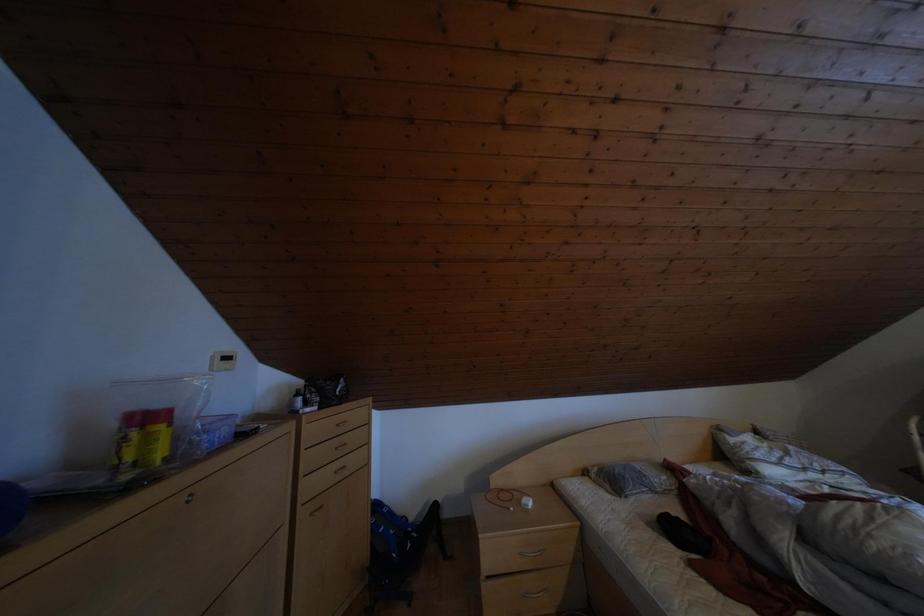
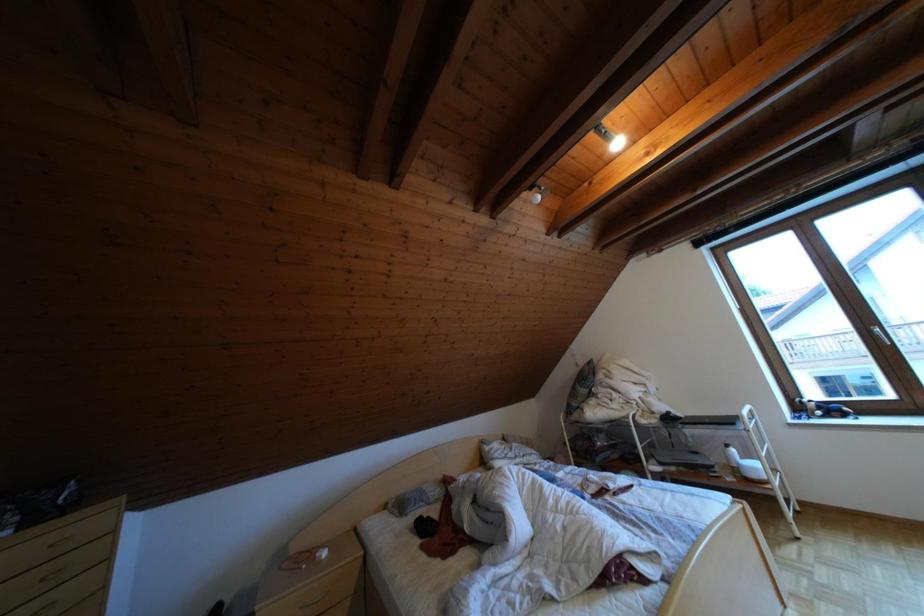
Question: The first image is from the beginning of the video and the second image is from the end. How did the camera likely rotate when shooting the video?

Choices:
 (A) Left
 (B) Right
 (C) Up
 (D) Down

Answer: (B)